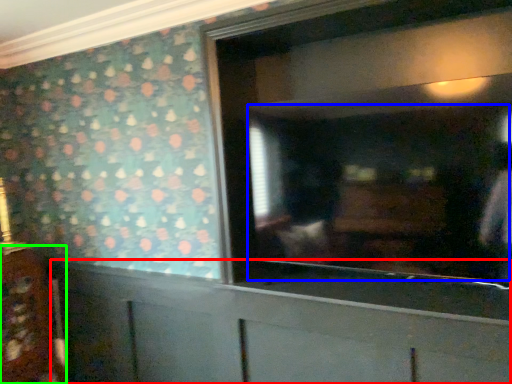
Question: Which object is the closest to the cabinetry (highlighted by a red box)? Choose among these: mirror (highlighted by a blue box) or cabinetry (highlighted by a green box).

Choices:
 (A) mirror
 (B) cabinetry

Answer: (A)